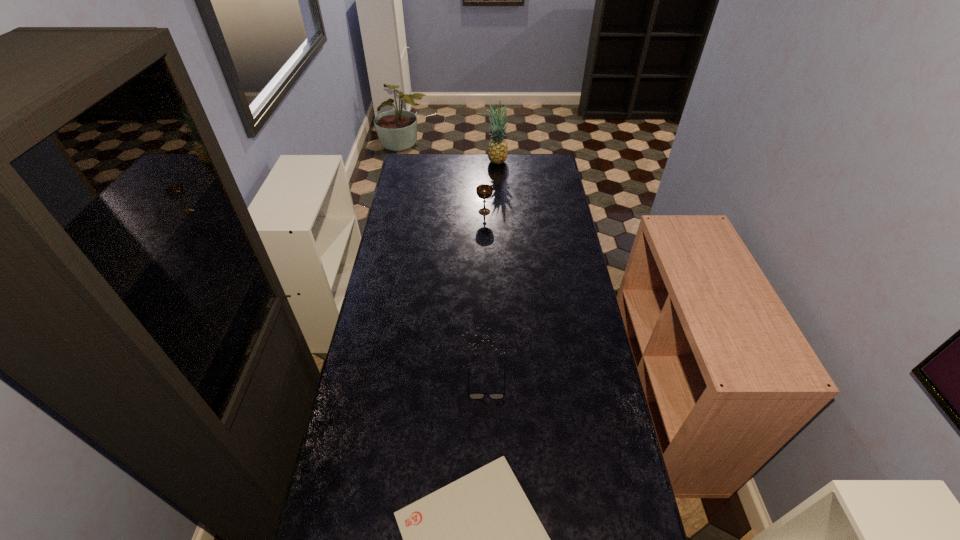
The height and width of the screenshot is (540, 960). I want to click on vacant point at the far edge, so click(x=455, y=156).

Locate an element on the screen. The width and height of the screenshot is (960, 540). free space at the left edge of the desktop is located at coordinates (396, 287).

This screenshot has height=540, width=960. In the image, there is a desktop. Find the location of `free space at the right edge`. free space at the right edge is located at coordinates (558, 309).

This screenshot has height=540, width=960. Find the location of `blank space at the far left corner`. blank space at the far left corner is located at coordinates (424, 161).

Identify the location of free point at the far right corner. (543, 161).

Locate an element on the screen. The image size is (960, 540). blank region between the third farthest object and the pineapple is located at coordinates (492, 273).

The image size is (960, 540). Find the location of `free space between the chalice and the third farthest object`. free space between the chalice and the third farthest object is located at coordinates (486, 298).

Identify the location of free area in between the spectacles and the third nearest object. The height and width of the screenshot is (540, 960). (486, 298).

The image size is (960, 540). What are the coordinates of `object that is the third closest one to the third nearest object` in the screenshot? It's located at (478, 539).

Point out which object is positioned as the nearest to the chalice. Please provide its 2D coordinates. Your answer should be formatted as a tuple, i.e. [(x, y)], where the tuple contains the x and y coordinates of a point satisfying the conditions above.

[(497, 150)]